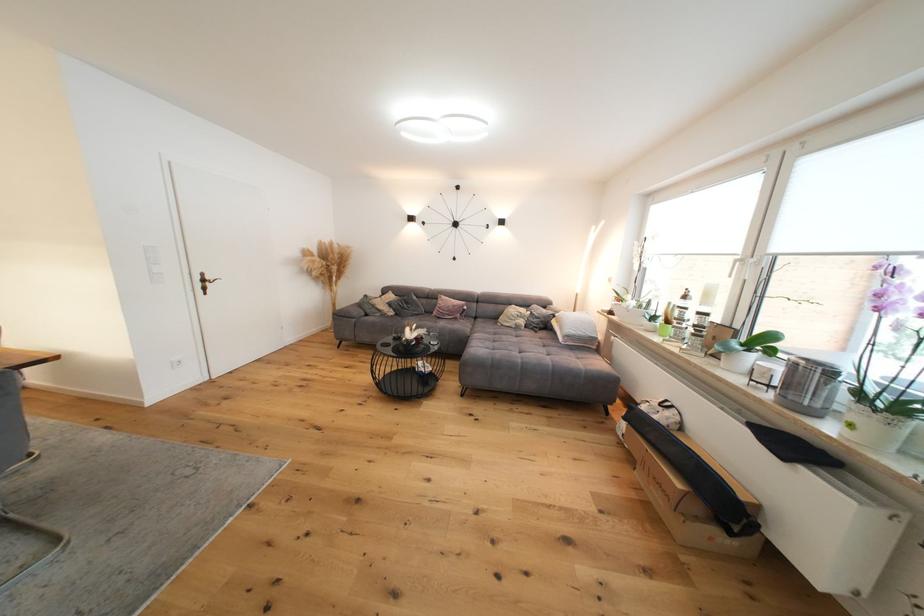
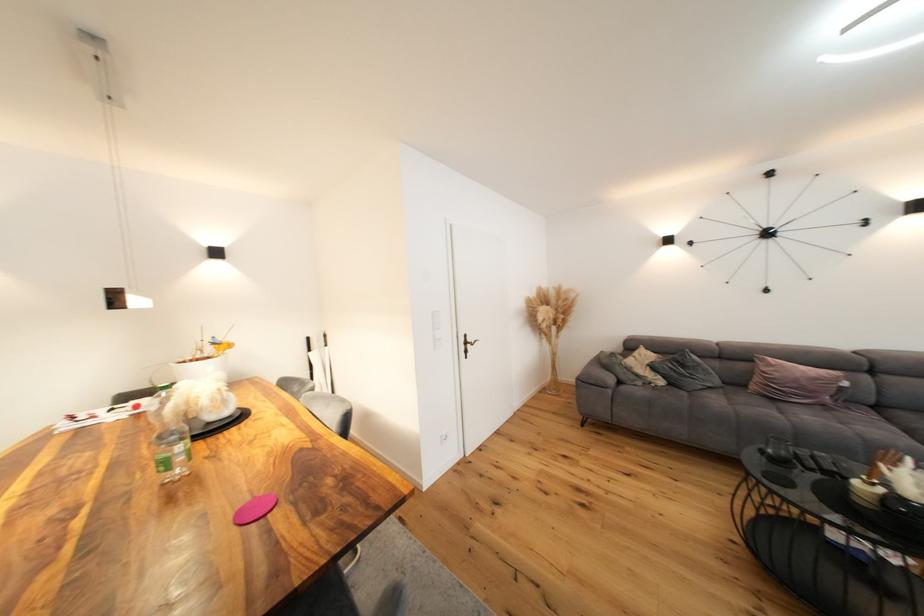
In the second image, find the point that corresponds to the point at 415,305 in the first image.

(690, 368)